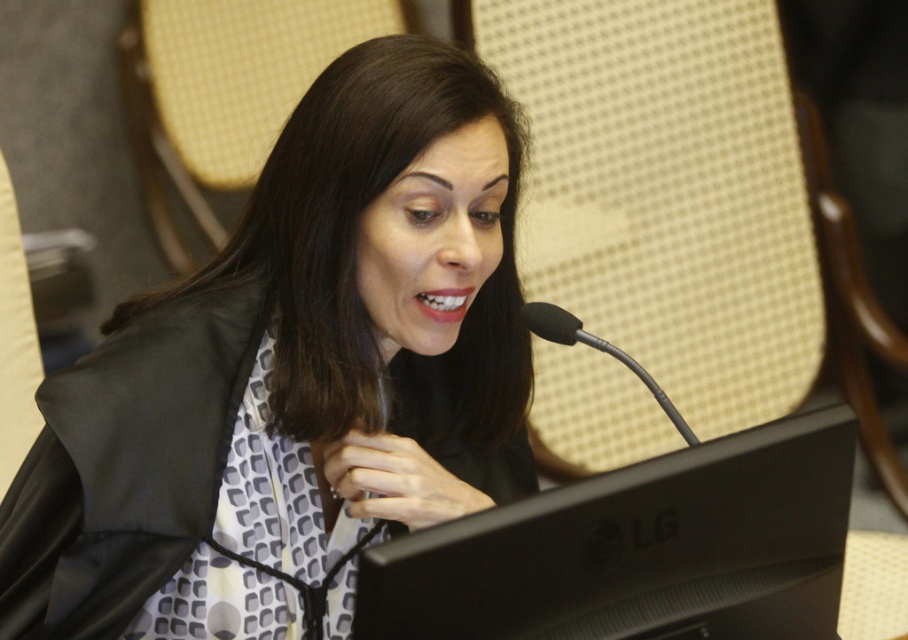
What are the coordinates of the black matte computer screen at center?

The black matte computer screen at center is located at coordinates point (638, 548).

You are an interior designer assessing the placement of furniture in the scene. The black matte jacket at center is located at coordinates point 0.591, 0.325. If you were to place a new table at point 0.6, 0.3, would the table interfere with the jacket?

The black matte jacket at center is located at point (294, 378). The table at point (271, 384) is very close but slightly offset. Since the jacket is centered at (294, 378), the table at (271, 384) would be just to the right and slightly below it. Depending on the jacket size, there might be minimal interference, but the coordinates are close enough that the table could potentially overlap or be too near the jacket.

You are an interior designer planning to place a new lamp in this room. The lamp has a base that requires a minimum of 0.3 meters of clear space around it to avoid obstruction. Given the coordinates provided for the black matte jacket at center, can you confirm if placing the lamp at point (294,378) would be safe?

The point (294,378) is marked as the location of the black matte jacket at center. Since the lamp base requires 0.3 meters of clear space, placing it directly at this point would not be safe as it would be obstructed by the jacket.